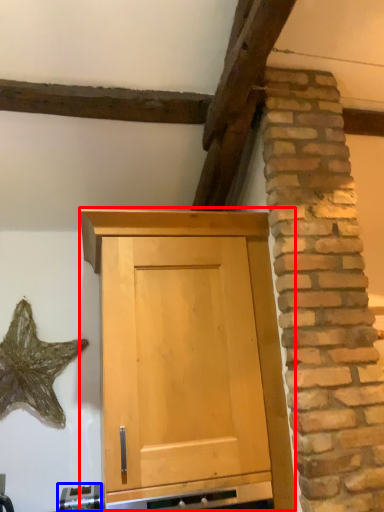
Question: Which object is further to the camera taking this photo, cupboard (highlighted by a red box) or appliance (highlighted by a blue box)?

Choices:
 (A) cupboard
 (B) appliance

Answer: (B)